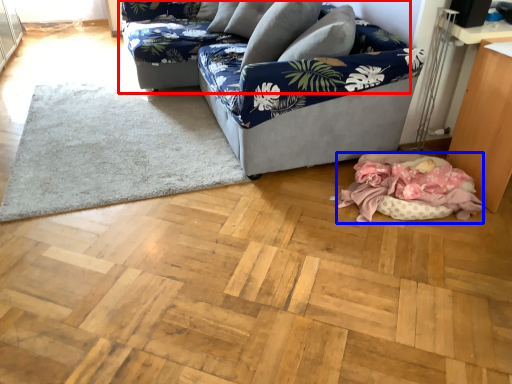
Question: Among these objects, which one is nearest to the camera, studio couch (highlighted by a red box) or blanket (highlighted by a blue box)?

Choices:
 (A) studio couch
 (B) blanket

Answer: (B)